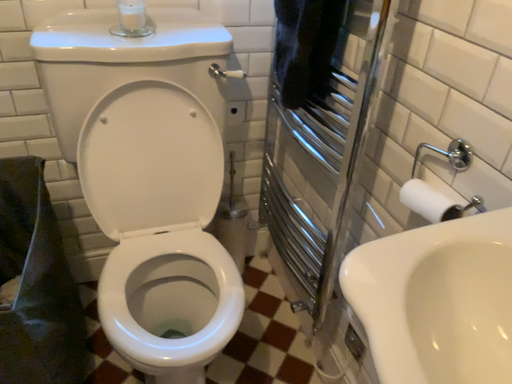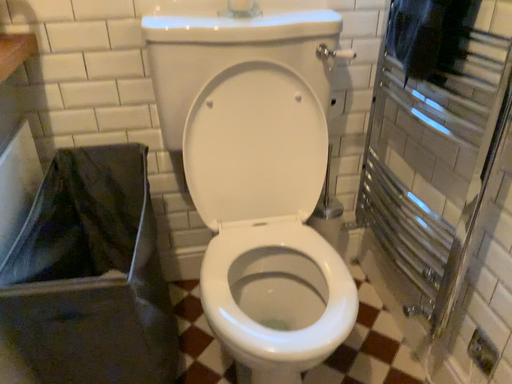
Question: Which way did the camera rotate in the video?

Choices:
 (A) rotated right
 (B) rotated left

Answer: (B)